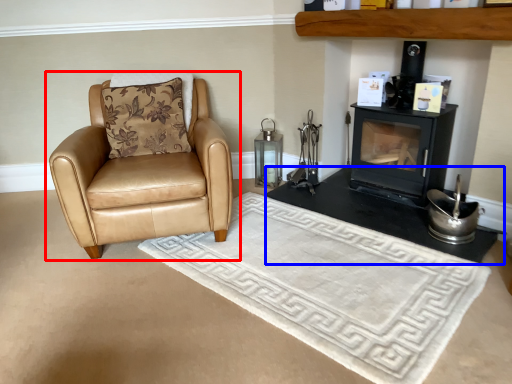
Question: Which object appears farthest to the camera in this image, chair (highlighted by a red box) or table (highlighted by a blue box)?

Choices:
 (A) chair
 (B) table

Answer: (B)